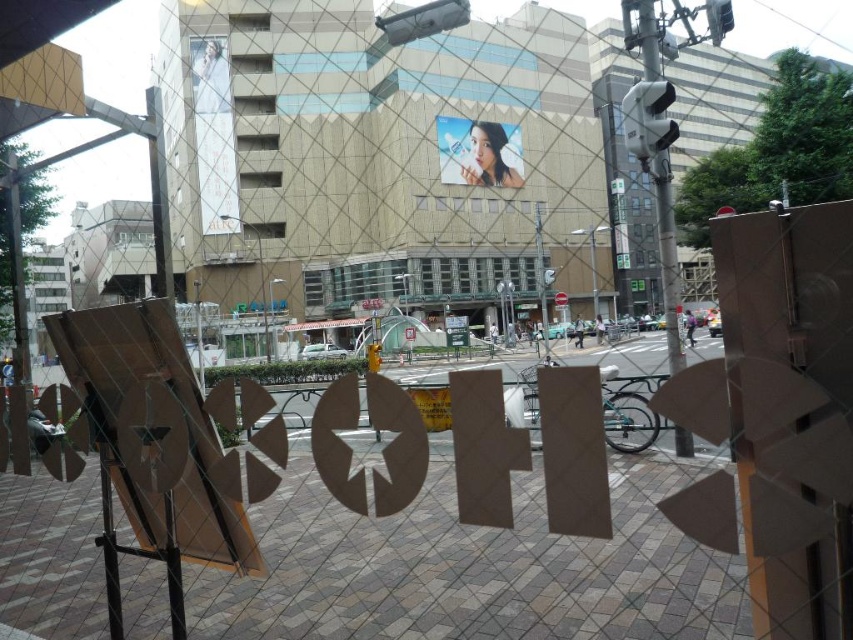
Question: Is white plastic traffic light at upper right to the right of metallic pole at center from the viewer's perspective?

Choices:
 (A) no
 (B) yes

Answer: (B)

Question: Which point is closer to the camera?

Choices:
 (A) white plastic traffic light at upper right
 (B) metallic pole at center
 (C) smooth glossy poster at center

Answer: (A)

Question: Does smooth glossy poster at center have a smaller size compared to white plastic traffic light at upper right?

Choices:
 (A) yes
 (B) no

Answer: (A)

Question: Among these points, which one is nearest to the camera?

Choices:
 (A) (244, 227)
 (B) (653, 147)

Answer: (B)

Question: Which object appears closest to the camera in this image?

Choices:
 (A) smooth glossy poster at center
 (B) white plastic traffic light at upper right

Answer: (B)

Question: Is white plastic traffic light at upper right further to the viewer compared to metallic pole at center?

Choices:
 (A) no
 (B) yes

Answer: (A)